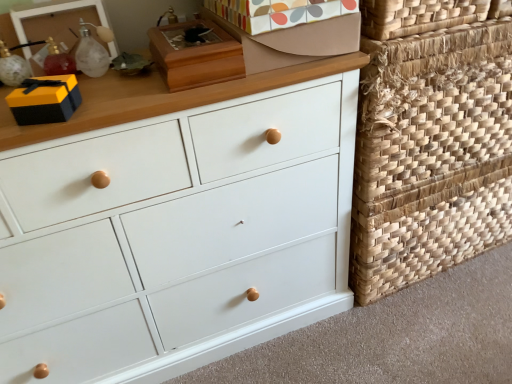
The width and height of the screenshot is (512, 384). Identify the location of vacant area that is situated to the right of matte black gift box at upper left. [x=125, y=109].